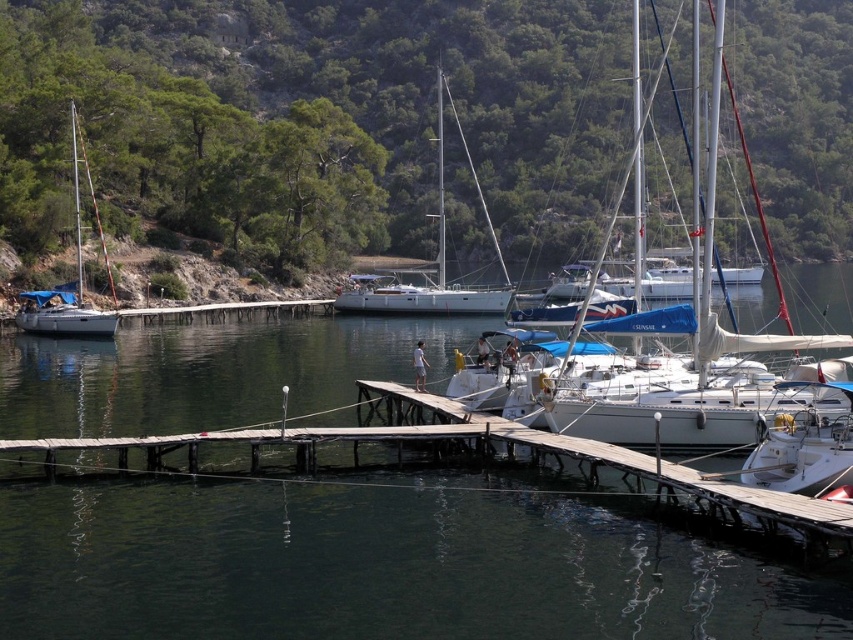
In order to click on white glossy sailboat at center in this screenshot , I will do `click(434, 260)`.

Is white glossy sailboat at center closer to the viewer compared to white matte sailboat at left?

No, it is not.

Describe the element at coordinates (434, 260) in the screenshot. I see `white glossy sailboat at center` at that location.

Where is `white glossy sailboat at center`? white glossy sailboat at center is located at coordinates (434, 260).

Which is in front, point (33, 440) or point (74, 147)?

Point (33, 440)

Is wooden dock at center to the right of white matte sailboat at left from the viewer's perspective?

Yes, wooden dock at center is to the right of white matte sailboat at left.

Between point (354, 429) and point (76, 332), which one is positioned behind?

Point (76, 332)

Find the location of a particular element. The height and width of the screenshot is (640, 853). wooden dock at center is located at coordinates (471, 460).

Can you confirm if wooden dock at center is taller than white glossy sailboat at center?

In fact, wooden dock at center may be shorter than white glossy sailboat at center.

Image resolution: width=853 pixels, height=640 pixels. In order to click on wooden dock at center in this screenshot , I will do `click(471, 460)`.

This screenshot has height=640, width=853. I want to click on wooden dock at center, so click(471, 460).